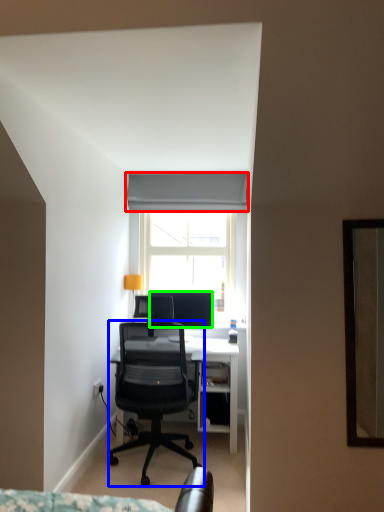
Question: Which is farther away from curtain (highlighted by a red box)? chair (highlighted by a blue box) or television (highlighted by a green box)?

Choices:
 (A) chair
 (B) television

Answer: (A)